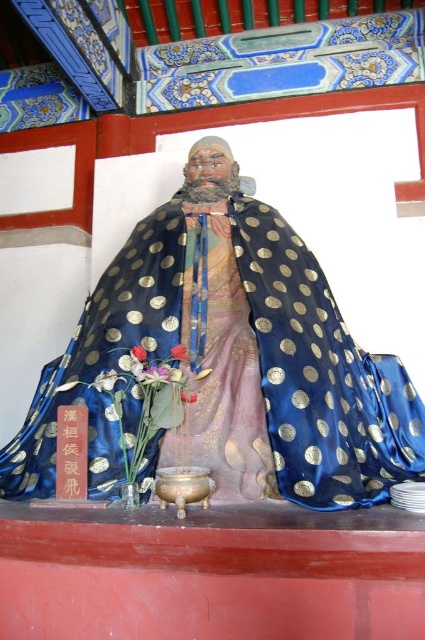
You are an interior designer planning to place a decorative item in the temple. You have a new golden vase that is 30 cm wide. The blue satin cape at center and pink silk flower at center are already present. Can the golden vase fit between them if the space between them is exactly 30 cm?

The blue satin cape at center is wider than the pink silk flower at center. However, the space between them is exactly 30 cm, which matches the vase width. Since the cape is wider, it might extend into the space, so the vase may not fit without adjusting their positions.

You are a temple visitor who wants to place a small offering in front of the statue. The offering is slightly larger than the vivid pink petals at center. Can you fit it in the space where the blue satin cape at center is located?

The blue satin cape at center is larger in size than the vivid pink petals at center. Since the offering is slightly larger than the petals, it should fit in the space where the cape is located as the cape is bigger.

You are a temple visitor who wants to place a new offering at the base of the statue. The offering requires placing something above the vivid pink petals at center. Can you use the pink silk flower at center for this purpose?

The vivid pink petals at center is below the pink silk flower at center, so yes, you can place the offering above the vivid pink petals at center by using the pink silk flower at center which is positioned above it.